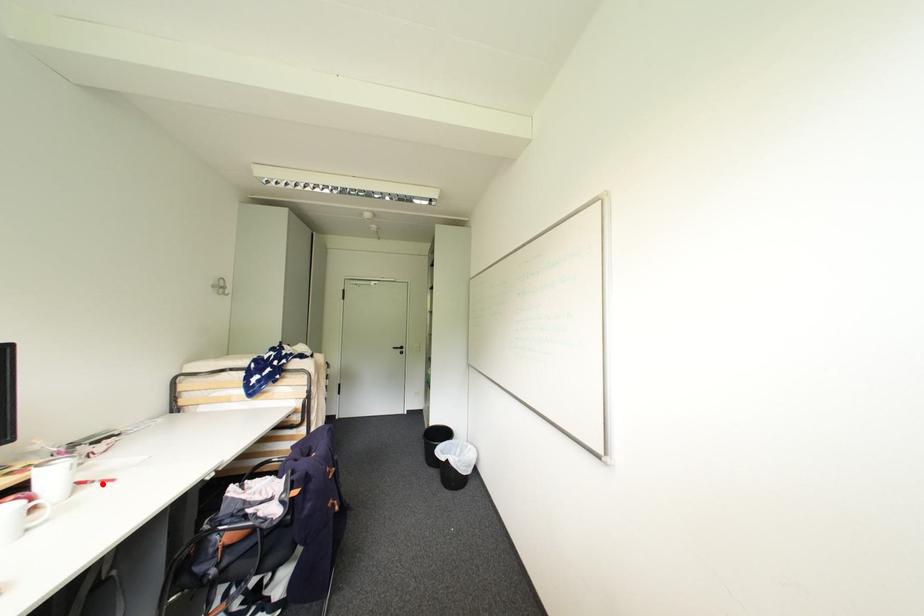
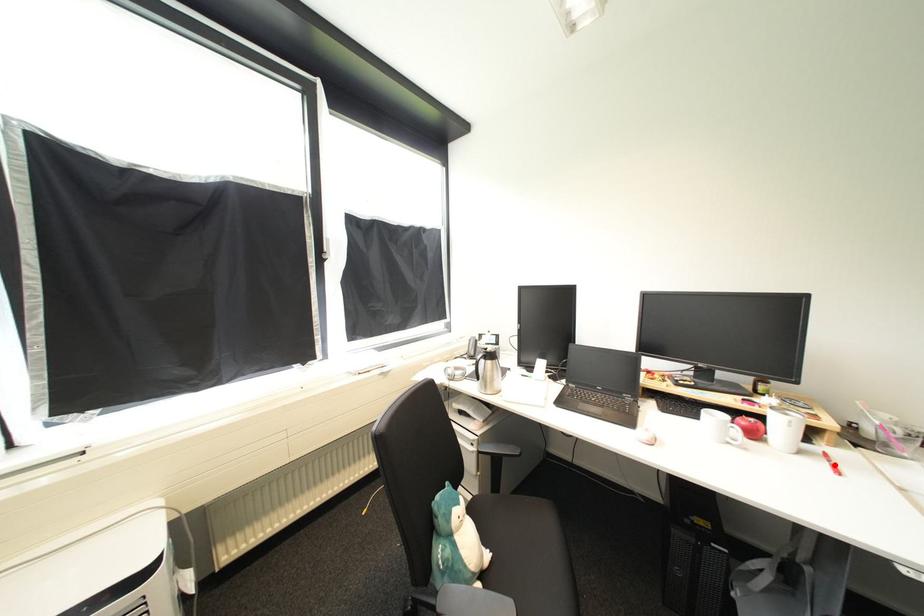
In the scene shown: I am providing you with two images of the same scene from different viewpoints. A red point is marked on the first image and another point is marked on the second image. Are the points marked in image1 and image2 representing the same 3D position?

Yes